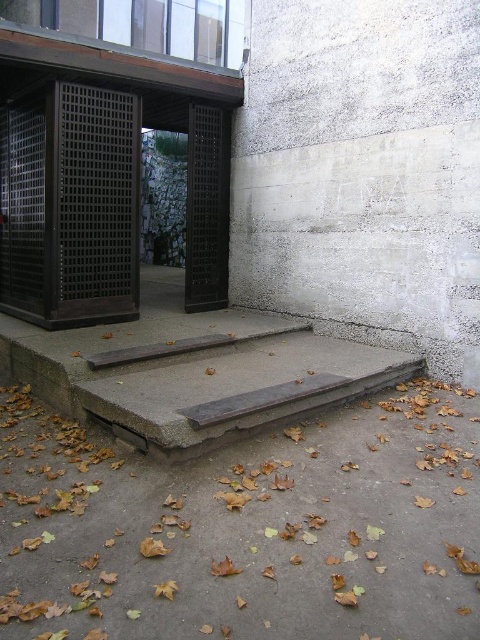
Does concrete/stained wood stairs at center have a smaller size compared to brown wooden rail at center?

No.

Does concrete/stained wood stairs at center appear on the left side of brown wooden rail at center?

No, concrete/stained wood stairs at center is not to the left of brown wooden rail at center.

Identify the location of concrete/stained wood stairs at center. (230, 381).